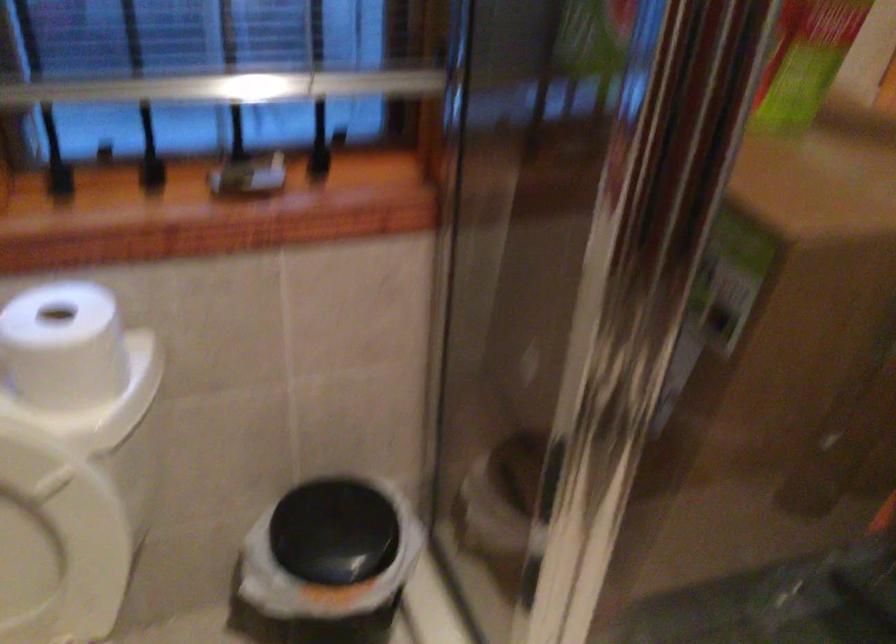
Identify the location of shower door frame. This screenshot has width=896, height=644. (616, 225).